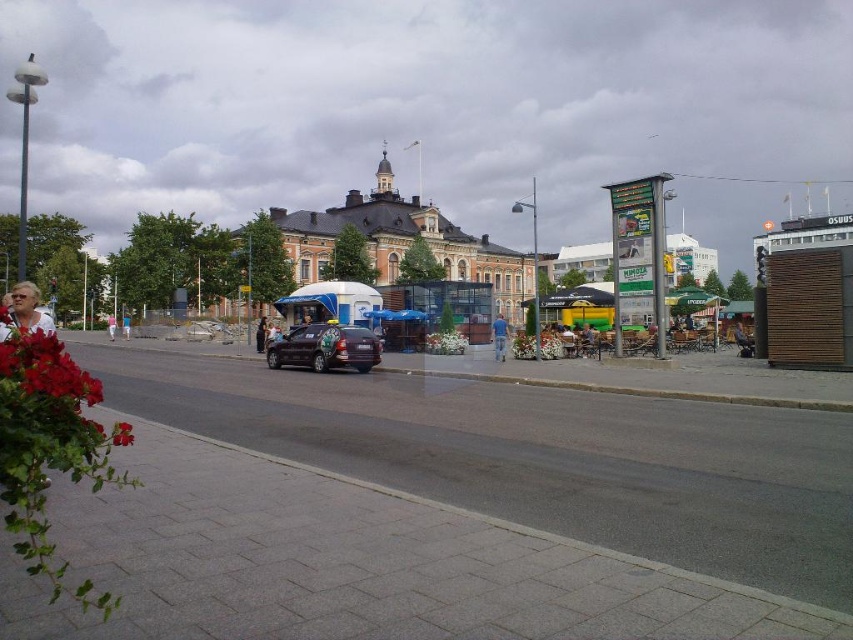
Question: Does matte white shirt at lower left have a larger size compared to light blue shirt at center?

Choices:
 (A) no
 (B) yes

Answer: (A)

Question: Which point is closer to the camera taking this photo?

Choices:
 (A) (357, 326)
 (B) (123, 320)

Answer: (A)

Question: In this image, where is matte white shirt at lower left located relative to blue jeans at center?

Choices:
 (A) above
 (B) below

Answer: (A)

Question: Among these points, which one is nearest to the camera?

Choices:
 (A) (108, 324)
 (B) (264, 323)
 (C) (315, 346)
 (D) (601, 316)

Answer: (C)

Question: Does yellow fabric umbrella at center appear on the right side of dark brown leather jacket at center?

Choices:
 (A) no
 (B) yes

Answer: (B)

Question: Which object is the closest to the pink fabric person at lower left?

Choices:
 (A) matte white shirt at lower left
 (B) dark brown leather jacket at center
 (C) yellow fabric umbrella at center
 (D) shiny black car at center

Answer: (B)